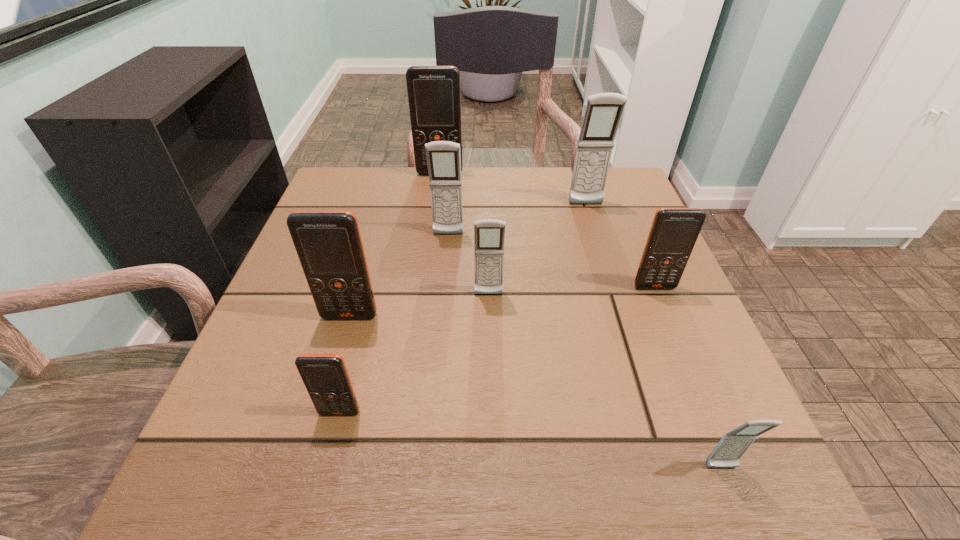
Where is `the second orange cellular telephone from right to left`? This screenshot has height=540, width=960. the second orange cellular telephone from right to left is located at coordinates (434, 98).

At what (x,y) coordinates should I click in order to perform the action: click on the farthest cellular telephone. Please return your answer as a coordinate pair (x, y). The image size is (960, 540). Looking at the image, I should click on (434, 98).

The width and height of the screenshot is (960, 540). I want to click on the third cellular telephone from right to left, so click(x=603, y=112).

Locate an element on the screen. the farthest gray cellular telephone is located at coordinates (603, 112).

You are a GUI agent. You are given a task and a screenshot of the screen. Output one action in this format:
    pyautogui.click(x=<x>, y=<y>)
    Task: Click on the third nearest gray cellular telephone
    
    Given the screenshot: What is the action you would take?
    pyautogui.click(x=443, y=157)

Where is `the third farthest object`? The height and width of the screenshot is (540, 960). the third farthest object is located at coordinates (443, 157).

You are a GUI agent. You are given a task and a screenshot of the screen. Output one action in this format:
    pyautogui.click(x=<x>, y=<y>)
    Task: Click on the third farthest orange cellular telephone
    
    Given the screenshot: What is the action you would take?
    pyautogui.click(x=328, y=243)

The height and width of the screenshot is (540, 960). I want to click on the sixth farthest object, so click(328, 243).

Where is `the second nearest gray cellular telephone`? the second nearest gray cellular telephone is located at coordinates (489, 235).

Image resolution: width=960 pixels, height=540 pixels. Find the location of `the fifth object from left to right`. the fifth object from left to right is located at coordinates (489, 235).